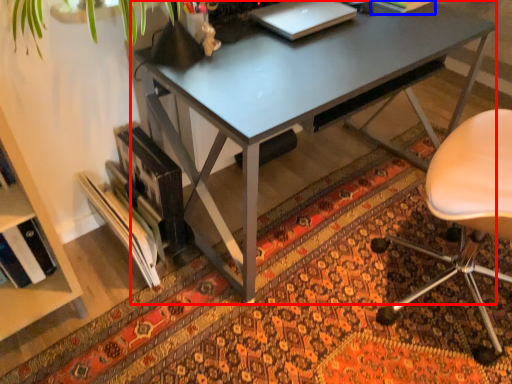
Question: Among these objects, which one is nearest to the camera, desk (highlighted by a red box) or book (highlighted by a blue box)?

Choices:
 (A) desk
 (B) book

Answer: (A)